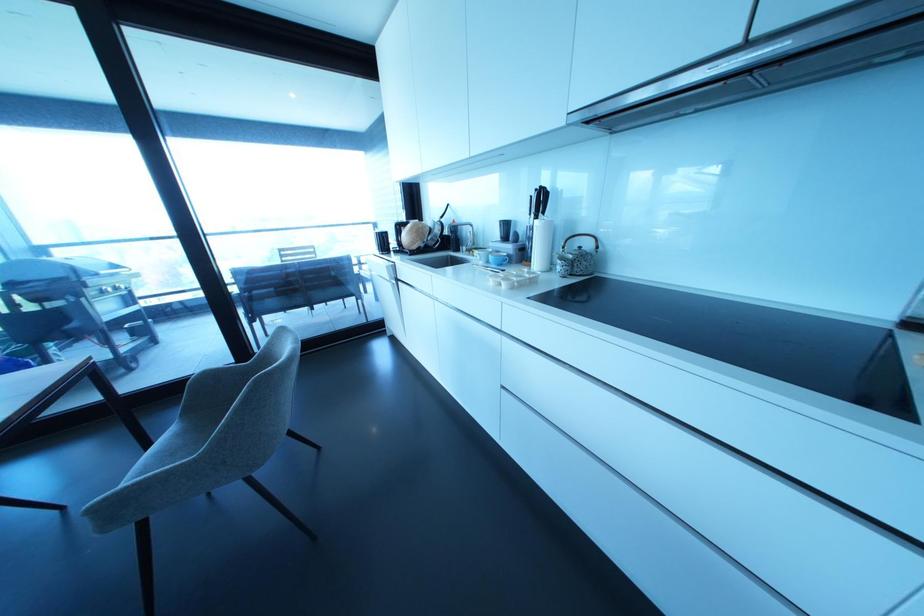
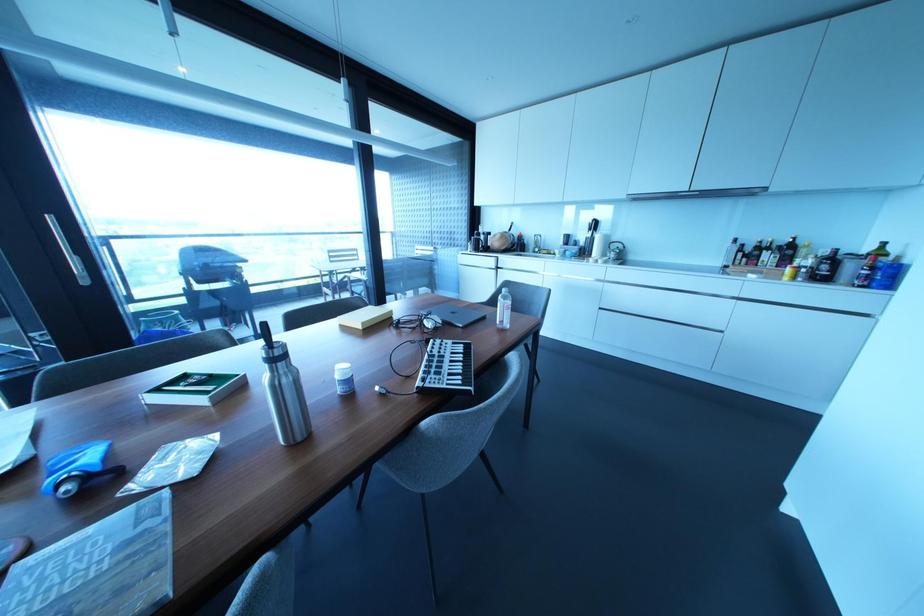
What movement of the cameraman would produce the second image?

The cameraman moved toward left, backward.